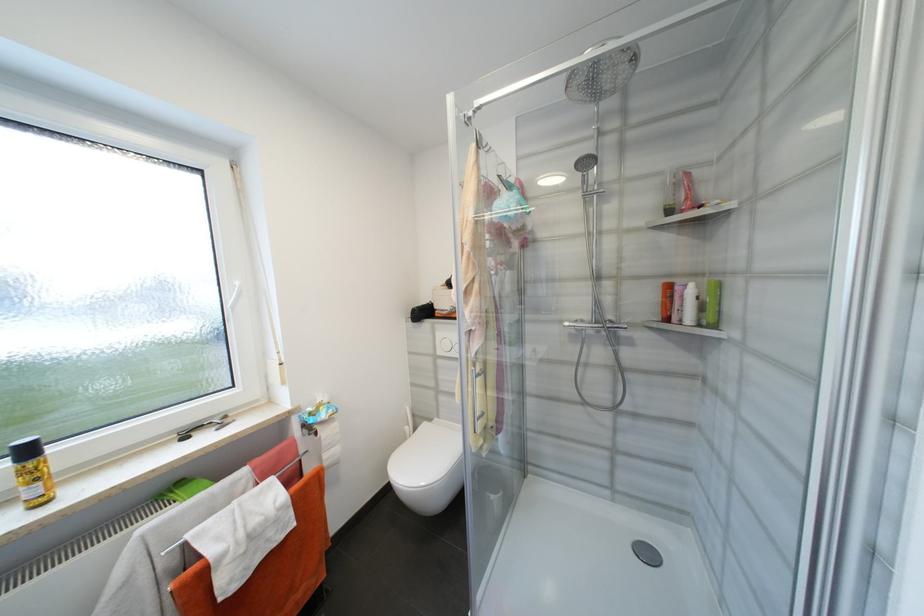
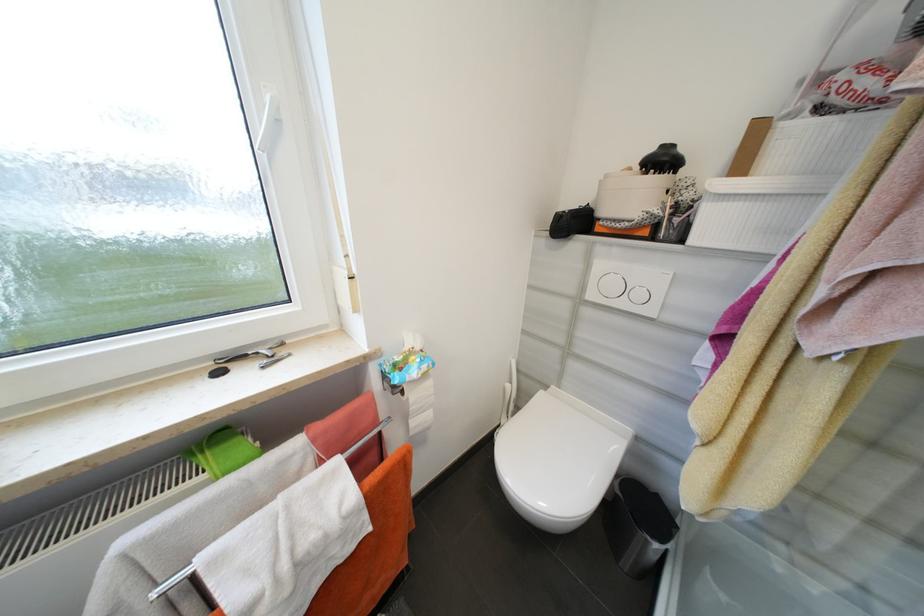
First-person continuous shooting, in which direction is the camera rotating?

The camera's rotation is toward left-down.